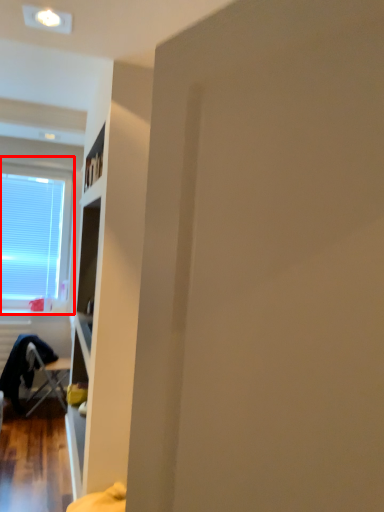
Question: Observing the image, what is the correct spatial positioning of window (annotated by the red box) in reference to chair?

Choices:
 (A) left
 (B) right

Answer: (A)